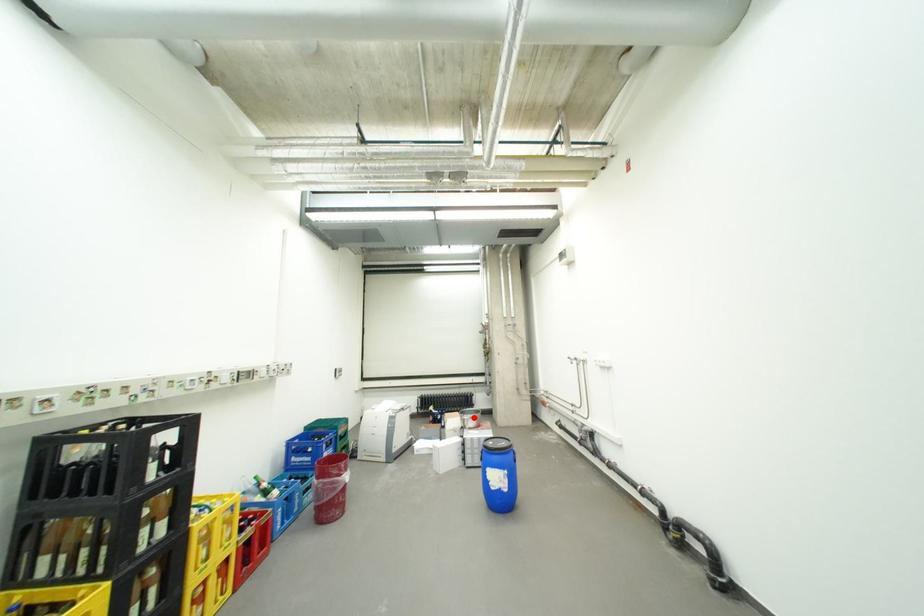
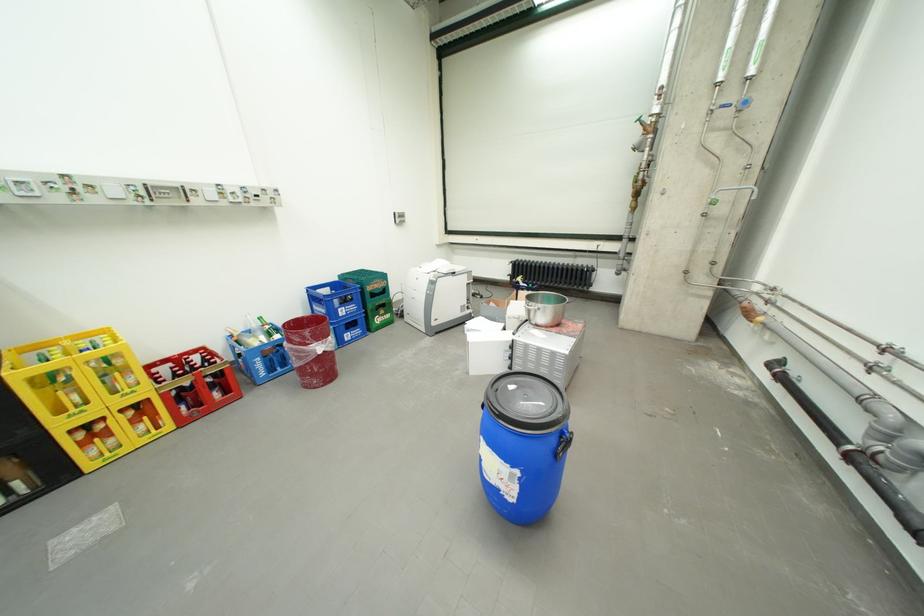
In the second image, find the point that corresponds to the highlighted location in the first image.

(540, 304)